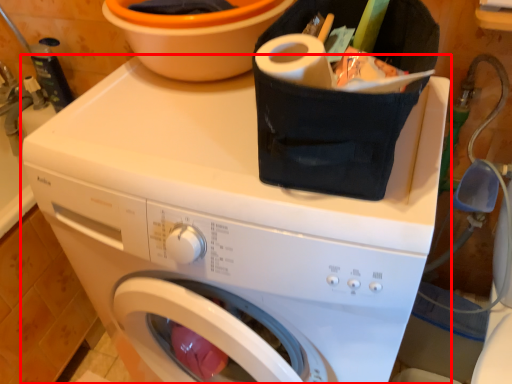
Question: Where is washing machine (annotated by the red box) located in relation to basin in the image?

Choices:
 (A) right
 (B) left

Answer: (A)